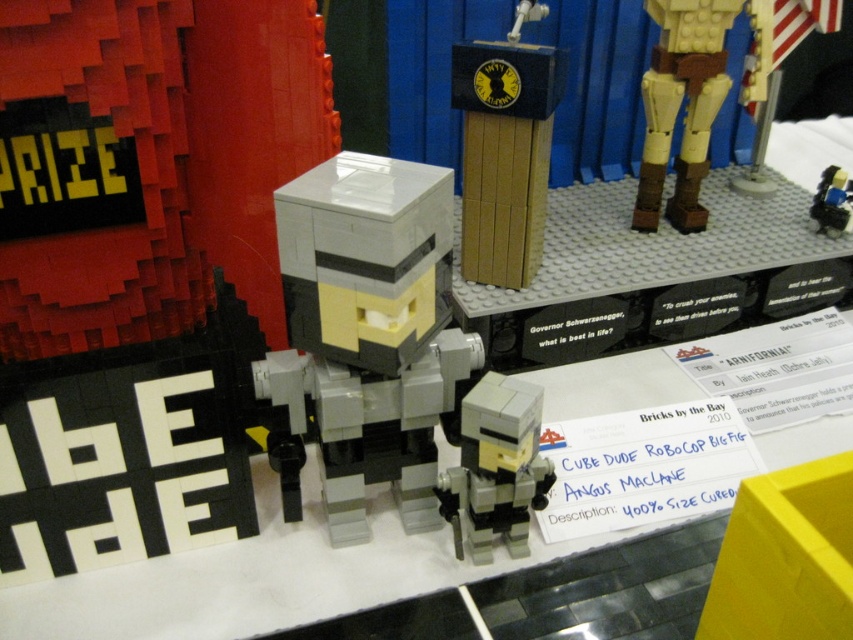
You are a LEGO enthusiast examining the display. You notice the white matte robocop at center and the yellow plastic flag at upper right. Which object is positioned closer to your viewpoint?

The white matte robocop at center is closer to the viewer than the yellow plastic flag at upper right.

You are a photographer trying to capture the LEGO display. You notice two points marked in the image at coordinates point (801, 35) and point (816, 200). Which point should you focus on first to ensure both are in sharp focus?

You should focus on point (801, 35) first because it is closer to the camera than point (816, 200), ensuring both points are within the depth of field.

Where is the white matte robocop at center located in the image?

The white matte robocop at center is located at point (369, 330).